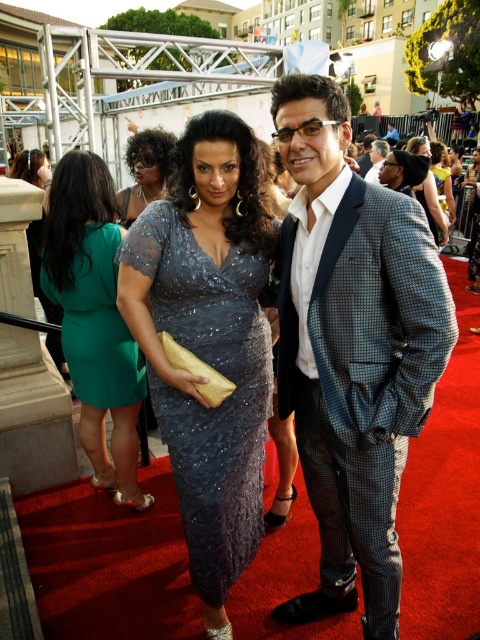
You are a photographer at the event and need to capture a closeup shot of both the shiny gold clutch at center and the shiny black suit at center. Given that your camera has a maximum focus range of 5 feet, will you be able to get both items in focus simultaneously?

The shiny gold clutch at center and shiny black suit at center are 5.79 feet apart from each other, which exceeds the camera maximum focus range of 5 feet. Therefore, you cannot get both items in focus simultaneously.

Based on the photo, you are a photographer at the event and need to capture a closeup shot of both the shiny gold clutch at center and the shiny black suit at center. Since your camera can only focus on one object at a time, which object should you choose to ensure the details are clearer?

The shiny gold clutch at center has a larger size compared to the shiny black suit at center, so focusing on the shiny gold clutch at center will allow for clearer details due to its larger surface area.

Consider the image. You are a photographer at the event and want to capture a closeup shot of the shiny gold clutch at center without the satin shimmer dress at center appearing in the background. Is the dress narrow enough to avoid being in the frame?

The satin shimmer dress at center is thinner than the shiny gold clutch at center, so it is narrow enough to avoid being in the frame if positioned correctly.